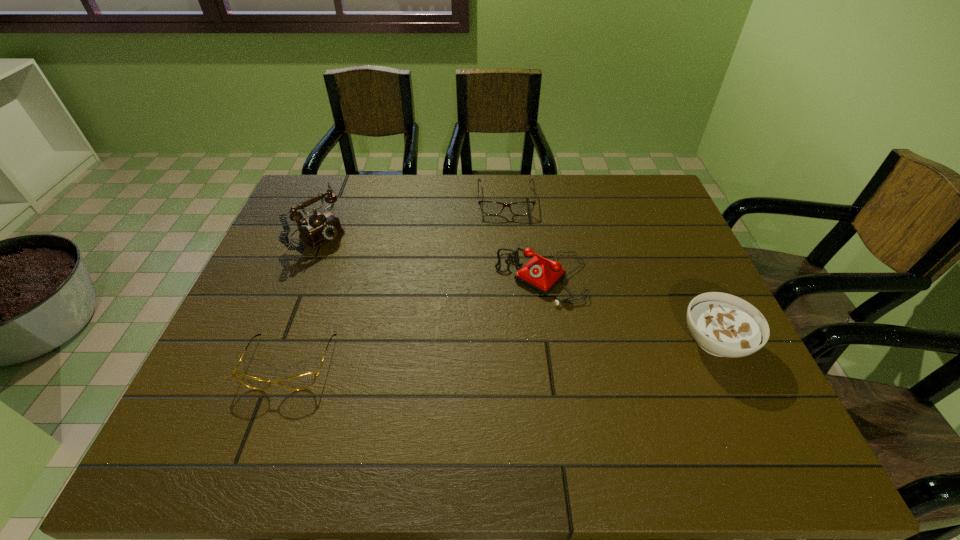
What are the coordinates of `the left spectacles` in the screenshot? It's located at (302, 381).

Where is `the rightmost object`? the rightmost object is located at coordinates (724, 325).

Locate an element on the screen. the right spectacles is located at coordinates (487, 207).

The image size is (960, 540). I want to click on the taller telephone, so click(x=320, y=227).

Where is `the left telephone`? This screenshot has width=960, height=540. the left telephone is located at coordinates (320, 227).

Image resolution: width=960 pixels, height=540 pixels. I want to click on the shorter telephone, so click(x=540, y=274).

In order to click on free spot located 0.110m on the left of the rightmost object in this screenshot , I will do `click(632, 341)`.

The width and height of the screenshot is (960, 540). I want to click on free region located on the lenses of the farther spectacles, so click(x=510, y=285).

Where is `vacant space located on the lenses of the farther spectacles`? vacant space located on the lenses of the farther spectacles is located at coordinates (510, 300).

You are a GUI agent. You are given a task and a screenshot of the screen. Output one action in this format:
    pyautogui.click(x=<x>, y=<y>)
    Task: Click on the free location located on the lenses of the farther spectacles
    
    Given the screenshot: What is the action you would take?
    pyautogui.click(x=509, y=269)